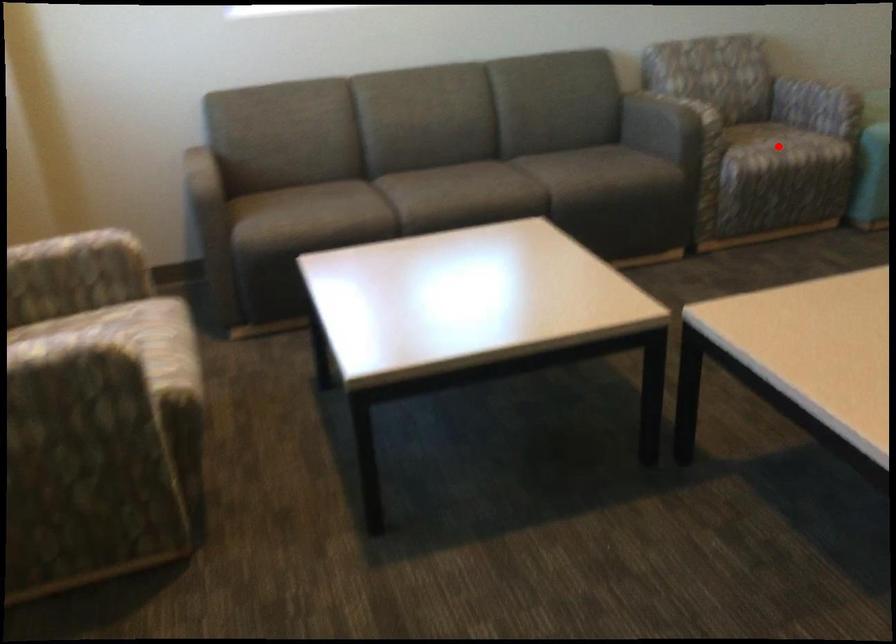
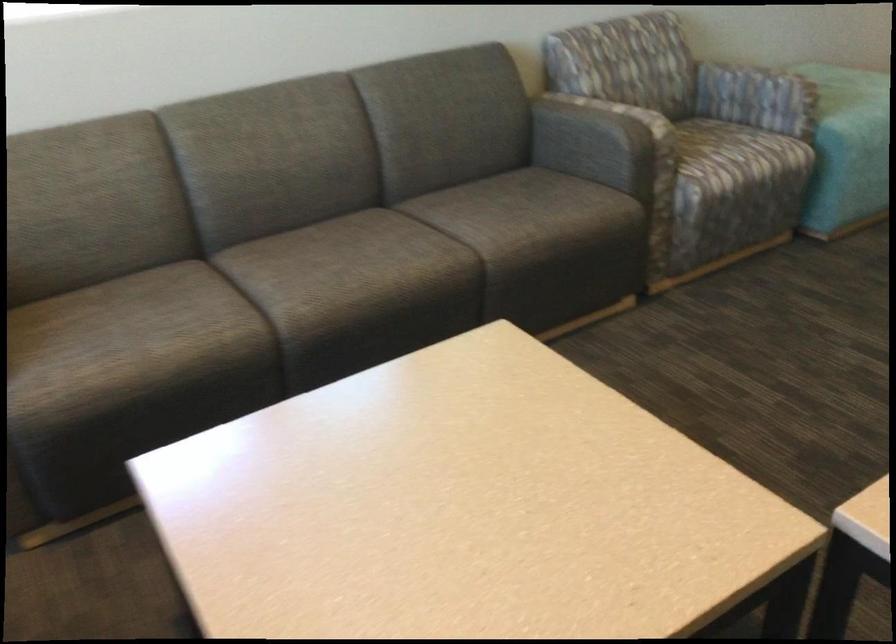
Find the pixel in the second image that matches the highlighted location in the first image.

(737, 155)